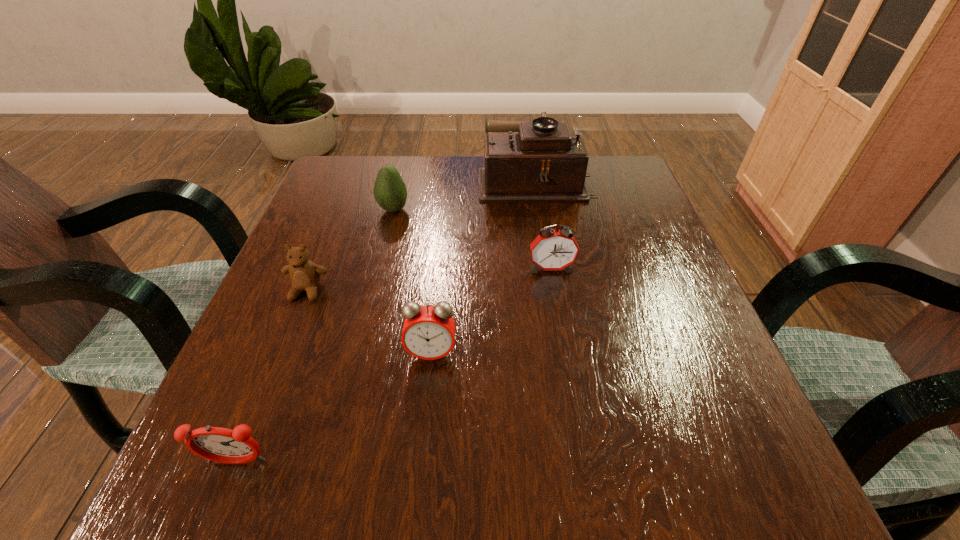
The height and width of the screenshot is (540, 960). Identify the location of free space between the nearest object and the second alarm clock from left to right. (334, 408).

I want to click on vacant area that lies between the tallest object and the fourth object from left to right, so click(483, 266).

Choose which object is the nearest neighbor to the fourth object from right to left. Please provide its 2D coordinates. Your answer should be formatted as a tuple, i.e. [(x, y)], where the tuple contains the x and y coordinates of a point satisfying the conditions above.

[(540, 161)]

The image size is (960, 540). What are the coordinates of `object that is the fourth closest to the third object from right to left` in the screenshot? It's located at (390, 192).

Locate an element on the screen. the closest alarm clock to the nearest alarm clock is located at coordinates (428, 333).

You are a GUI agent. You are given a task and a screenshot of the screen. Output one action in this format:
    pyautogui.click(x=<x>, y=<y>)
    Task: Click on the third closest alarm clock to the avocado
    
    Given the screenshot: What is the action you would take?
    pyautogui.click(x=217, y=444)

This screenshot has height=540, width=960. In order to click on blank space that satisfies the following two spatial constraints: 1. on the horn of the phonograph_record; 2. on the front-facing side of the second alarm clock from right to left in this screenshot , I will do 564,353.

In order to click on vacant space that satisfies the following two spatial constraints: 1. on the horn of the phonograph_record; 2. on the front-facing side of the teddy bear in this screenshot , I will do `click(554, 291)`.